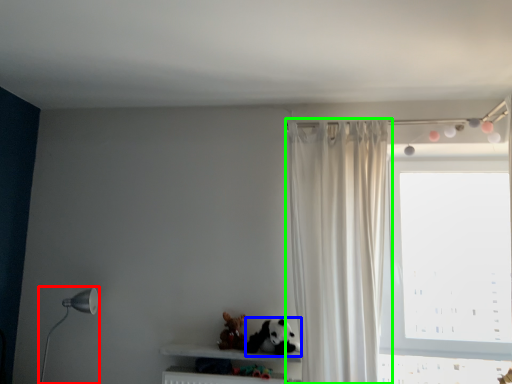
Question: Which object is positioned farthest from table lamp (highlighted by a red box)? Select from animal (highlighted by a blue box) and curtain (highlighted by a green box).

Choices:
 (A) animal
 (B) curtain

Answer: (B)